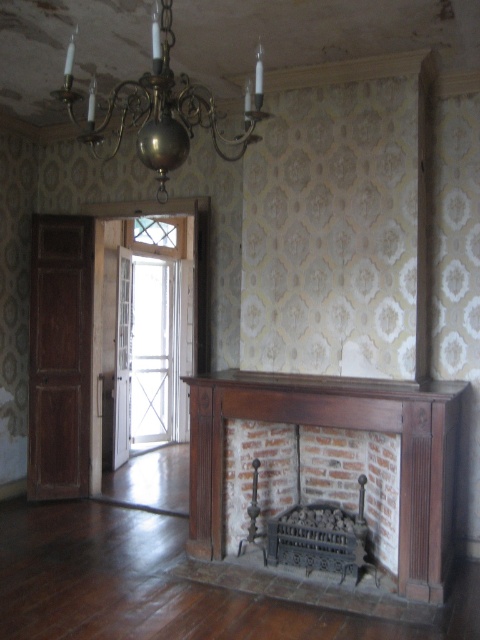
Which is more to the right, brown wooden fireplace at center or brick fireplace at center?

brown wooden fireplace at center is more to the right.

The height and width of the screenshot is (640, 480). What do you see at coordinates (343, 428) in the screenshot?
I see `brown wooden fireplace at center` at bounding box center [343, 428].

The width and height of the screenshot is (480, 640). What are the coordinates of `brown wooden fireplace at center` in the screenshot? It's located at [x=343, y=428].

Does brown wooden fireplace at center have a lesser width compared to brass/copper chandelier at upper center?

Incorrect, brown wooden fireplace at center's width is not less than brass/copper chandelier at upper center's.

Who is positioned more to the left, brown wooden fireplace at center or brass/copper chandelier at upper center?

brass/copper chandelier at upper center

Locate an element on the screen. brown wooden fireplace at center is located at coordinates (343, 428).

Is brick fireplace at center thinner than brass/copper chandelier at upper center?

No.

How much distance is there between brick fireplace at center and brass/copper chandelier at upper center?

The distance of brick fireplace at center from brass/copper chandelier at upper center is 7.46 feet.

Is point (333, 483) positioned behind point (170, 90)?

Yes, it is.

This screenshot has width=480, height=640. Find the location of `brick fireplace at center`. brick fireplace at center is located at coordinates (312, 477).